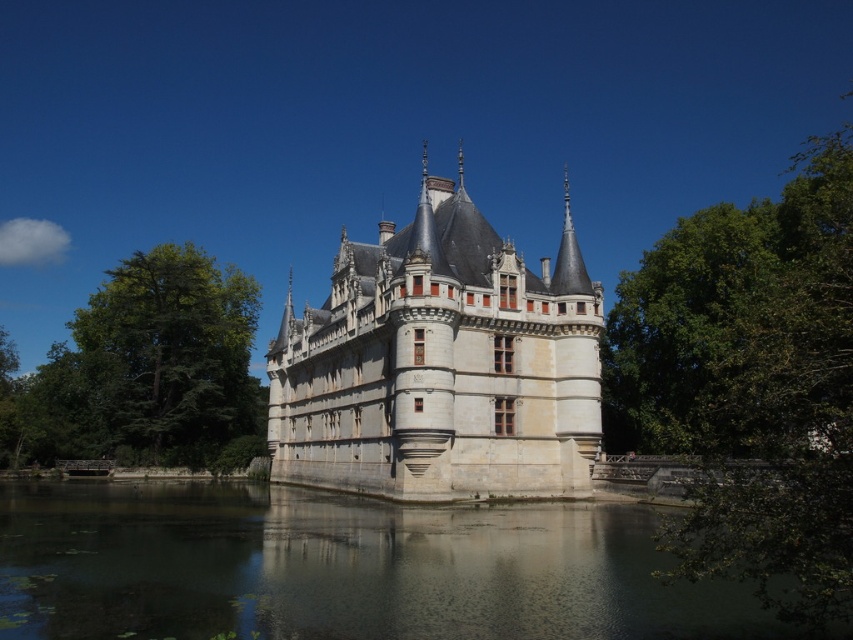
Which is more to the right, transparent water at lower center or green leafy tree at left?

From the viewer's perspective, transparent water at lower center appears more on the right side.

Does transparent water at lower center appear on the right side of green leafy tree at left?

Yes, transparent water at lower center is to the right of green leafy tree at left.

Which is behind, point (585, 628) or point (80, 344)?

The point (80, 344) is more distant.

You are a GUI agent. You are given a task and a screenshot of the screen. Output one action in this format:
    pyautogui.click(x=<x>, y=<y>)
    Task: Click on the transparent water at lower center
    This screenshot has height=640, width=853.
    Given the screenshot: What is the action you would take?
    pyautogui.click(x=341, y=568)

Does transparent water at lower center have a greater height compared to stone castle at center?

Incorrect, transparent water at lower center's height is not larger of stone castle at center's.

Between transparent water at lower center and stone castle at center, which one appears on the left side from the viewer's perspective?

transparent water at lower center

Where is `transparent water at lower center`? The width and height of the screenshot is (853, 640). transparent water at lower center is located at coordinates (341, 568).

Which is above, green leafy tree at right or green leafy tree at left?

green leafy tree at right is above.

Does point (703, 548) come behind point (149, 260)?

No, it is in front of (149, 260).

Locate an element on the screen. This screenshot has width=853, height=640. green leafy tree at right is located at coordinates (751, 384).